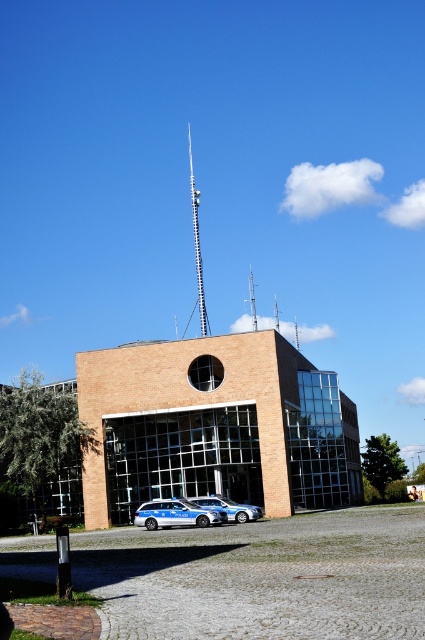
You are a pedestrian standing in front of the modern building. You see the silver metallic tower at upper center and the blue metallic car at center. Which object is closer to you?

The blue metallic car at center is behind the silver metallic tower at upper center, so the silver metallic tower at upper center is closer to you.

From the picture: You are a city planner reviewing the building layout. You need to install a new security camera. The camera requires a mounting point that is both higher and larger than the existing metallic tower at center. Is the silver metallic tower at upper center suitable for this purpose?

The silver metallic tower at upper center has a larger size compared to metallic tower at center, so it is suitable as a mounting point for the security camera since it meets the requirement of being both higher and larger than the existing metallic tower at center.

You are a photographer planning to take a photo of the silver metallic tower at upper center and the blue metallic car at center. Based on their sizes in the image, which object will appear taller in the photo?

The silver metallic tower at upper center will appear taller in the photo because it has a greater height compared to the blue metallic car at center.